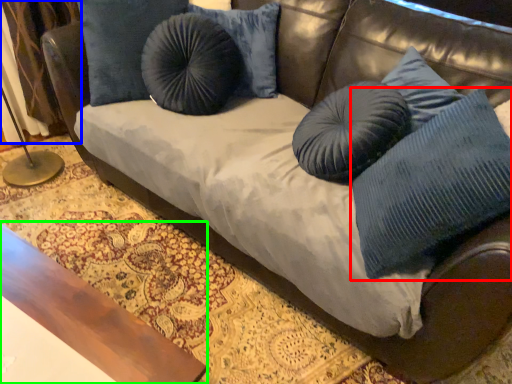
Question: Based on their relative distances, which object is farther from pillow (highlighted by a red box)? Choose from curtain (highlighted by a blue box) and table (highlighted by a green box).

Choices:
 (A) curtain
 (B) table

Answer: (A)